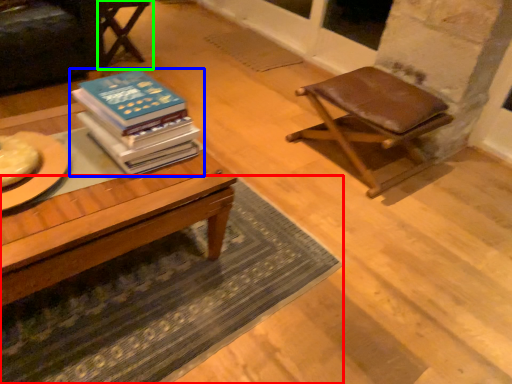
Question: Which object is the closest to the mat (highlighted by a red box)? Choose among these: book (highlighted by a blue box) or chair (highlighted by a green box).

Choices:
 (A) book
 (B) chair

Answer: (A)